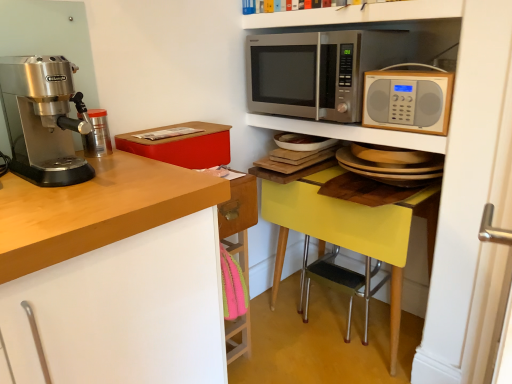
Question: From a real-world perspective, is black rubber step stool at lower center on polished stainless steel espresso machine at left?

Choices:
 (A) no
 (B) yes

Answer: (A)

Question: Does black rubber step stool at lower center have a lesser width compared to polished stainless steel espresso machine at left?

Choices:
 (A) no
 (B) yes

Answer: (B)

Question: Can you confirm if black rubber step stool at lower center is bigger than polished stainless steel espresso machine at left?

Choices:
 (A) yes
 (B) no

Answer: (B)

Question: Are black rubber step stool at lower center and polished stainless steel espresso machine at left located far from each other?

Choices:
 (A) no
 (B) yes

Answer: (B)

Question: Is black rubber step stool at lower center positioned before polished stainless steel espresso machine at left?

Choices:
 (A) no
 (B) yes

Answer: (A)

Question: Is black rubber step stool at lower center positioned with its back to polished stainless steel espresso machine at left?

Choices:
 (A) yes
 (B) no

Answer: (B)

Question: Is white glossy shelf at upper center, marked as the 2th shelf in a bottom-to-top arrangement, outside polished stainless steel espresso machine at left?

Choices:
 (A) yes
 (B) no

Answer: (A)

Question: From the image's perspective, is white glossy shelf at upper center, acting as the first shelf starting from the top, beneath polished stainless steel espresso machine at left?

Choices:
 (A) yes
 (B) no

Answer: (B)

Question: Is white glossy shelf at upper center, acting as the first shelf starting from the top, taller than polished stainless steel espresso machine at left?

Choices:
 (A) no
 (B) yes

Answer: (A)

Question: Is white glossy shelf at upper center, acting as the first shelf starting from the top, positioned in front of polished stainless steel espresso machine at left?

Choices:
 (A) no
 (B) yes

Answer: (A)

Question: Is white glossy shelf at upper center, acting as the first shelf starting from the top, to the right of polished stainless steel espresso machine at left from the viewer's perspective?

Choices:
 (A) no
 (B) yes

Answer: (B)

Question: From a real-world perspective, is white glossy shelf at upper center, marked as the 2th shelf in a bottom-to-top arrangement, beneath polished stainless steel espresso machine at left?

Choices:
 (A) yes
 (B) no

Answer: (B)

Question: From the image's perspective, would you say matte red box at upper left is positioned over white glossy shelf at upper center, marked as the 2th shelf in a bottom-to-top arrangement?

Choices:
 (A) no
 (B) yes

Answer: (A)